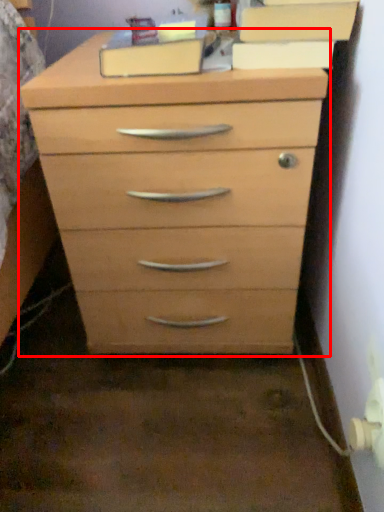
Question: In this image, where is chest of drawers (annotated by the red box) located relative to cabinetry?

Choices:
 (A) right
 (B) left

Answer: (B)